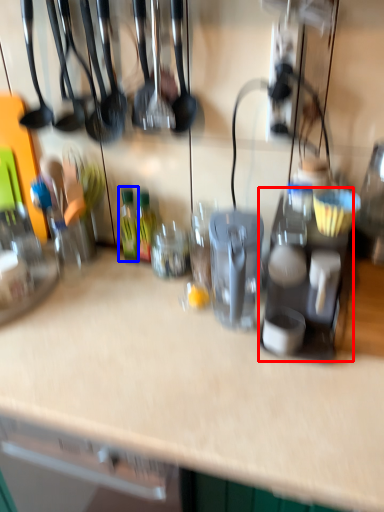
Question: Which object is further to the camera taking this photo, appliance (highlighted by a red box) or bottle (highlighted by a blue box)?

Choices:
 (A) appliance
 (B) bottle

Answer: (B)